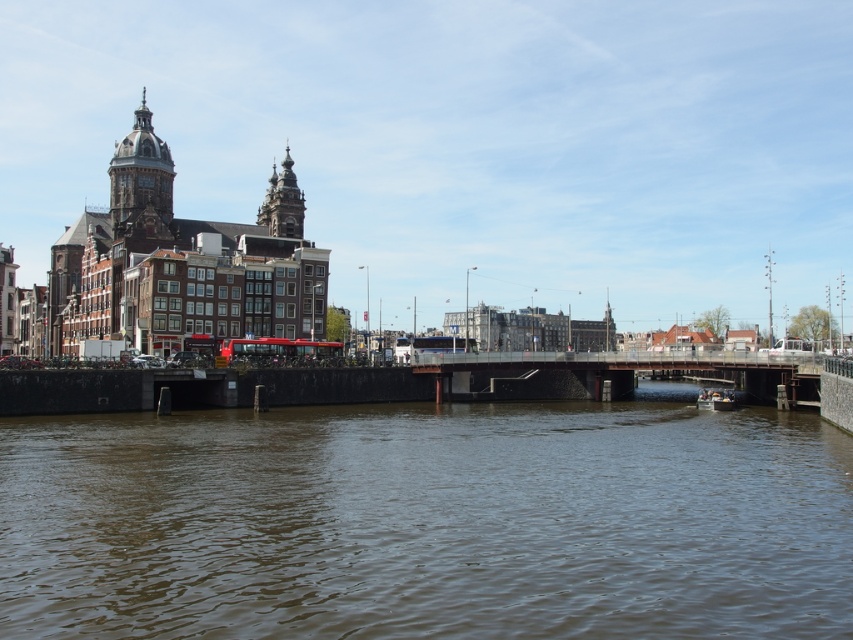
Is the position of red rubber bus at center less distant than that of smooth black boat at lower right?

That is True.

Between red rubber bus at center and smooth black boat at lower right, which one has more height?

With more height is red rubber bus at center.

You are a GUI agent. You are given a task and a screenshot of the screen. Output one action in this format:
    pyautogui.click(x=<x>, y=<y>)
    Task: Click on the red rubber bus at center
    The image size is (853, 640).
    Given the screenshot: What is the action you would take?
    pyautogui.click(x=277, y=349)

Where is `brown murky water at center`? The image size is (853, 640). brown murky water at center is located at coordinates (428, 522).

The image size is (853, 640). Describe the element at coordinates (428, 522) in the screenshot. I see `brown murky water at center` at that location.

Is point (143, 509) in front of point (747, 371)?

That is True.

At what (x,y) coordinates should I click in order to perform the action: click on brown murky water at center. Please return your answer as a coordinate pair (x, y). The image size is (853, 640). Looking at the image, I should click on (428, 522).

Can you confirm if metallic gray bridge at center is smaller than matte gray dome at upper left?

No, metallic gray bridge at center is not smaller than matte gray dome at upper left.

Does point (804, 360) come farther from viewer compared to point (143, 148)?

No.

Where is `metallic gray bridge at center`? The image size is (853, 640). metallic gray bridge at center is located at coordinates (598, 372).